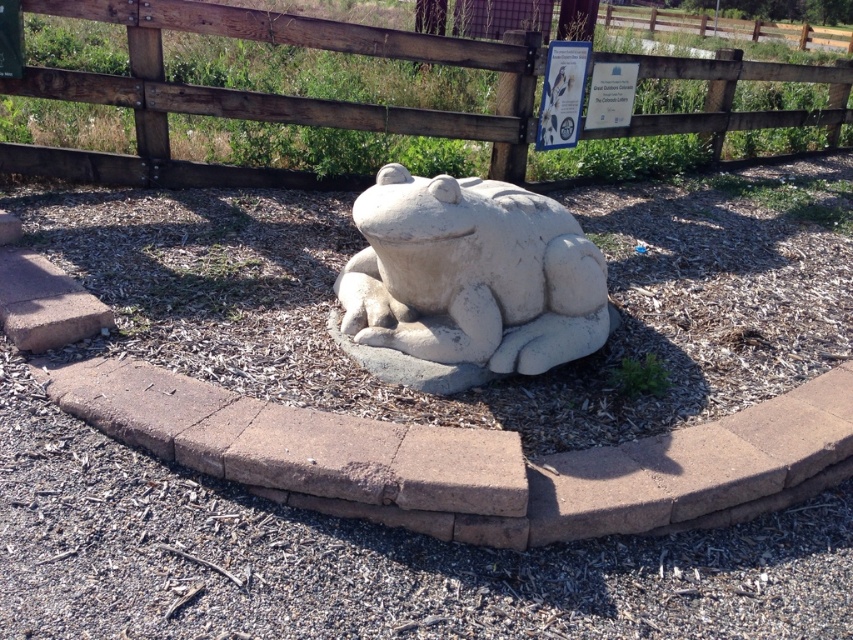
Which is below, wooden fence at upper center or white stone frog at center?

white stone frog at center is below.

Consider the image. Which is above, wooden fence at upper center or white stone frog at center?

Positioned higher is wooden fence at upper center.

Which is in front, point (674, 72) or point (582, 269)?

Positioned in front is point (582, 269).

This screenshot has width=853, height=640. Identify the location of wooden fence at upper center. tap(264, 93).